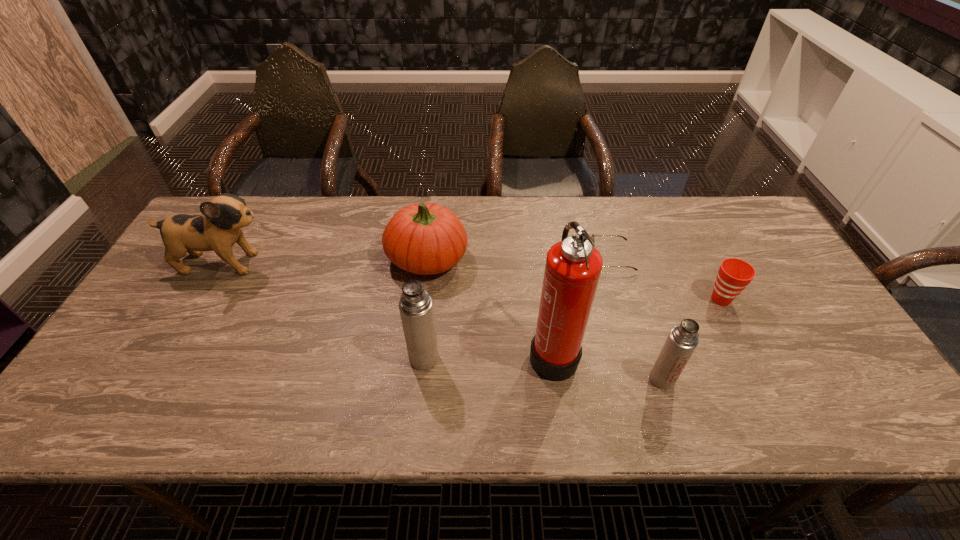
Please point out where to position a new thermos bottle on the left to maintain spacing. Please provide its 2D coordinates. Your answer should be formatted as a tuple, i.e. [(x, y)], where the tuple contains the x and y coordinates of a point satisfying the conditions above.

[(204, 338)]